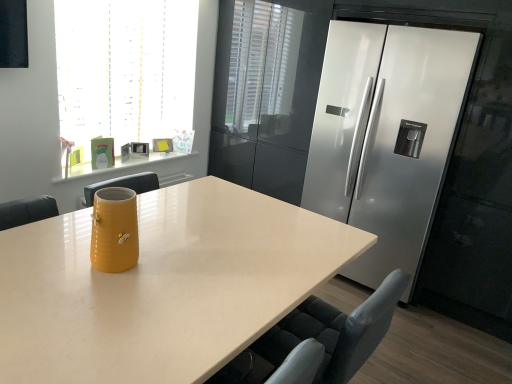
Identify the location of vacant space behind yellow ceramic vase at center. (152, 237).